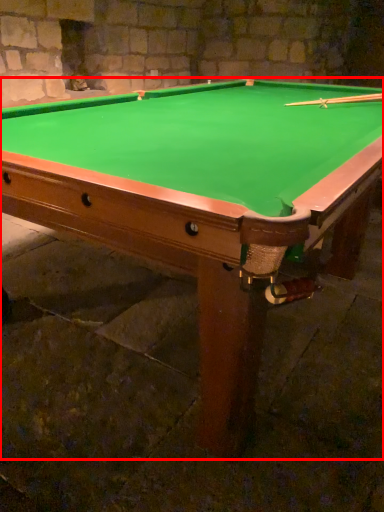
Question: In this image, where is billiard table (annotated by the red box) located relative to cue?

Choices:
 (A) right
 (B) left

Answer: (B)